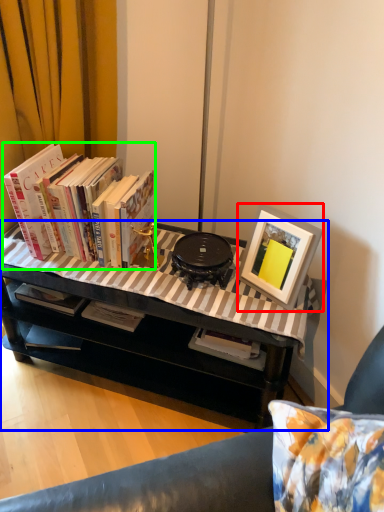
Question: Based on their relative distances, which object is nearer to picture frame (highlighted by a red box)? Choose from table (highlighted by a blue box) and book (highlighted by a green box).

Choices:
 (A) table
 (B) book

Answer: (A)